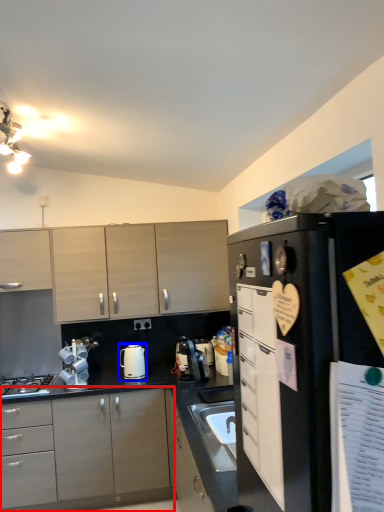
Question: Which of the following is the farthest to the observer, cabinetry (highlighted by a red box) or kitchen appliance (highlighted by a blue box)?

Choices:
 (A) cabinetry
 (B) kitchen appliance

Answer: (B)